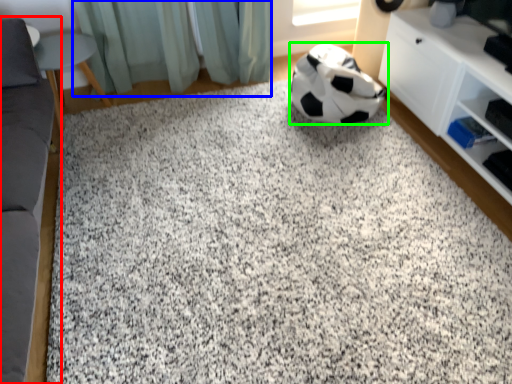
Question: Which object is positioned closest to furniture (highlighted by a red box)? Select from curtain (highlighted by a blue box) and football (highlighted by a green box).

Choices:
 (A) curtain
 (B) football

Answer: (A)